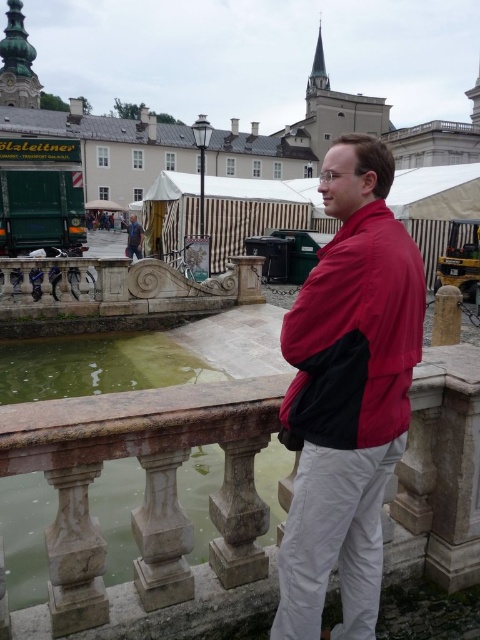
You are a tourist in the square and see the red matte jacket at center and the blue denim jeans at lower left. Which item is positioned lower from the ground?

The red matte jacket at center is below blue denim jeans at lower left, so the red matte jacket at center is positioned lower from the ground.

You are an architect designing a new plaza and want to place a statue exactly where the red matte jacket at center is currently positioned. What are the coordinates for the statue placement?

The coordinates for placing the statue should be at point (355, 337), as that is where the red matte jacket at center is located.